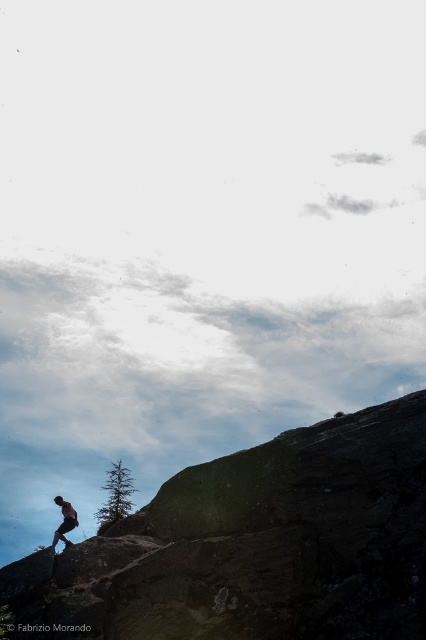
Identify the location of rough textured rock at lower right. (253, 545).

Does rough textured rock at lower right have a lesser width compared to dark brown leather pants at lower left?

No.

Measure the distance between rough textured rock at lower right and camera.

rough textured rock at lower right is 24.22 meters from camera.

This screenshot has width=426, height=640. Find the location of `rough textured rock at lower right`. rough textured rock at lower right is located at coordinates (253, 545).